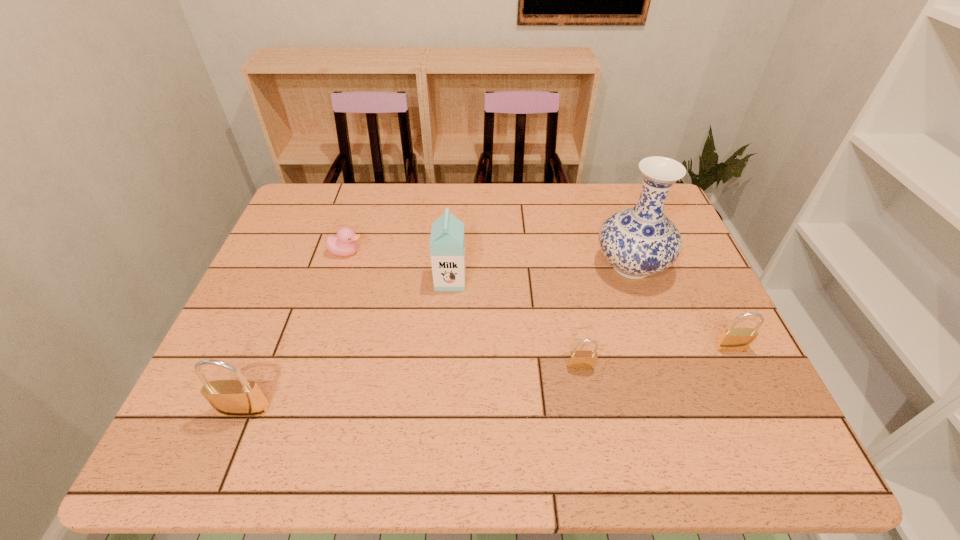
Locate an element on the screen. milk carton is located at coordinates click(x=447, y=242).

The width and height of the screenshot is (960, 540). Find the location of `blank space located on the front-facing side of the second nearest padlock`. blank space located on the front-facing side of the second nearest padlock is located at coordinates click(588, 407).

At what (x,y) coordinates should I click in order to perform the action: click on free spot located on the front-facing side of the fourth farthest object. Please return your answer as a coordinate pair (x, y). Looking at the image, I should click on (748, 382).

Identify the location of vacant space situated 0.120m on the front of the second object from right to left. (654, 331).

Where is `blank space located 0.230m on the front-facing side of the duckling`? The height and width of the screenshot is (540, 960). blank space located 0.230m on the front-facing side of the duckling is located at coordinates (445, 252).

Image resolution: width=960 pixels, height=540 pixels. What are the coordinates of `vacant space located on the left of the second tallest object` in the screenshot? It's located at (346, 280).

The height and width of the screenshot is (540, 960). Find the location of `object present at the near edge`. object present at the near edge is located at coordinates (241, 397).

Find the location of a particular element. Image resolution: width=960 pixels, height=540 pixels. padlock located in the left edge section of the desktop is located at coordinates (241, 397).

Locate an element on the screen. The height and width of the screenshot is (540, 960). duckling at the left edge is located at coordinates (344, 244).

At what (x,y) coordinates should I click in order to perform the action: click on padlock that is at the right edge. Please return your answer as a coordinate pair (x, y). The height and width of the screenshot is (540, 960). Looking at the image, I should click on (732, 339).